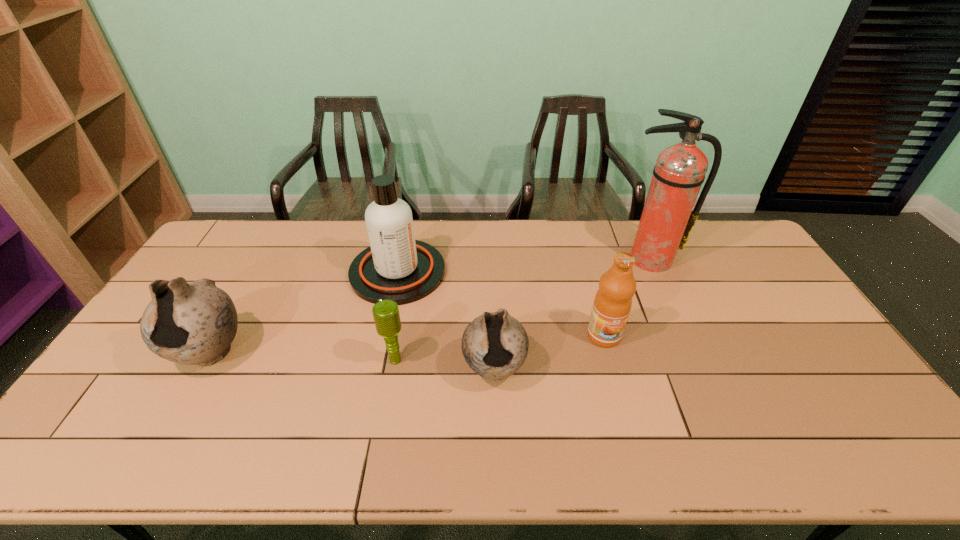
Please point a spot on the right to add another pottery. Please provide its 2D coordinates. Your answer should be formatted as a tuple, i.e. [(x, y)], where the tuple contains the x and y coordinates of a point satisfying the conditions above.

[(798, 386)]